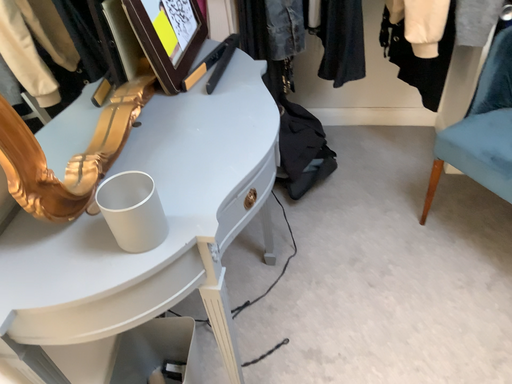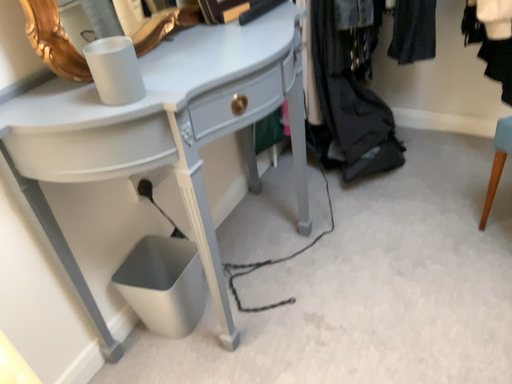
Question: How did the camera likely rotate when shooting the video?

Choices:
 (A) rotated upward
 (B) rotated downward

Answer: (A)